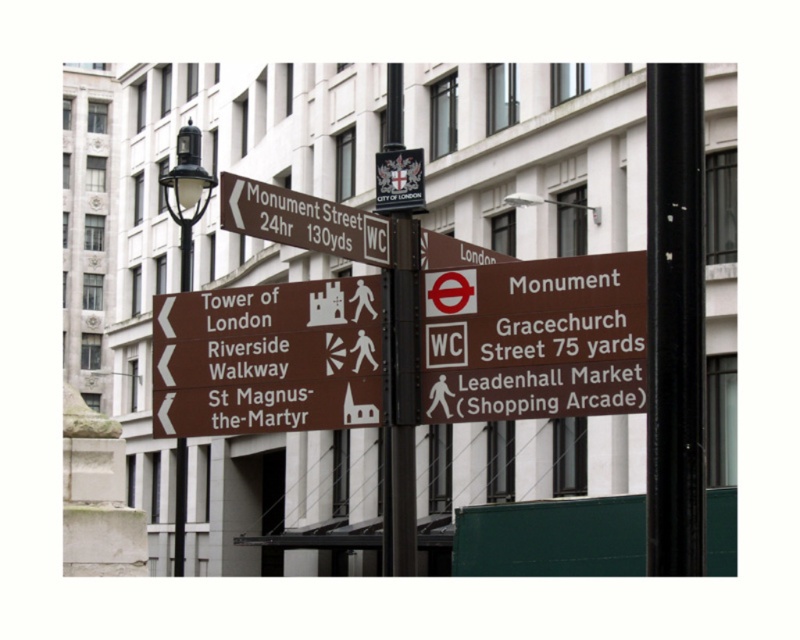
You are a tourist holding a map that is 1 foot wide. You want to check the brown matte sign at upper left and the black polished metal streetlight at left for directions. Can your map fit next to the narrower object without overlapping?

The brown matte sign at upper left is narrower than the black polished metal streetlight at left. Since the map is 1 foot wide, it can fit next to the brown matte sign at upper left without overlapping because the sign is narrower than the streetlight.

You are a tourist holding a map and looking at the black metal pole at right and the brown matte sign at upper left. Which object would appear larger to you in the scene?

The black metal pole at right is bigger than the brown matte sign at upper left, so it would appear larger to you.

You are standing at the base of the black metal pole at right. Looking towards the street signboard, which direction should you face to see the Tower of London sign first?

The Tower of London sign is located on the street signboard mounted on the black metal pole at right. Since the main sign for Monument Street is at the top, the Tower of London sign would be positioned below it. To see the Tower of London sign first, you should face north towards the signboard.